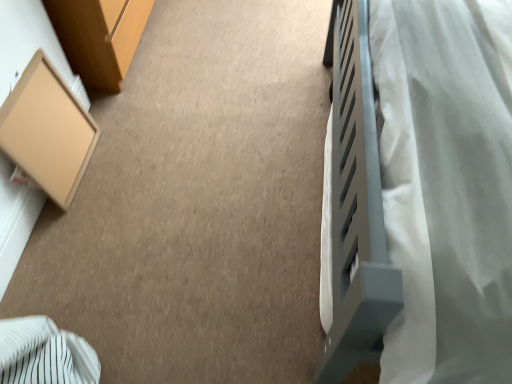
Question: Looking at their shapes, would you say matte cardboard box at left is wider or thinner than white soft fabric at right?

Choices:
 (A) wide
 (B) thin

Answer: (B)

Question: From a real-world perspective, is matte cardboard box at left physically located above or below white soft fabric at right?

Choices:
 (A) below
 (B) above

Answer: (A)

Question: Is point (17, 124) positioned closer to the camera than point (484, 190)?

Choices:
 (A) farther
 (B) closer

Answer: (A)

Question: In terms of width, does white soft fabric at right look wider or thinner when compared to matte cardboard box at left?

Choices:
 (A) wide
 (B) thin

Answer: (A)

Question: From the image's perspective, relative to matte cardboard box at left, is white soft fabric at right above or below?

Choices:
 (A) below
 (B) above

Answer: (B)

Question: Based on their positions, is white soft fabric at right located to the left or right of matte cardboard box at left?

Choices:
 (A) left
 (B) right

Answer: (B)

Question: Do you think white soft fabric at right is within matte cardboard box at left, or outside of it?

Choices:
 (A) inside
 (B) outside

Answer: (B)